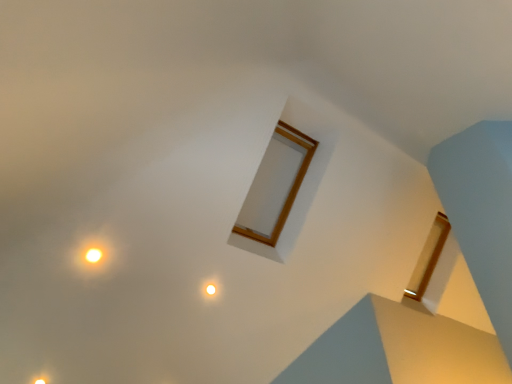
Question: Does yellow matte light at upper left, positioned as the 3th light in bottom-to-top order, appear on the left side of matte white light at center, acting as the third light starting from the front?

Choices:
 (A) no
 (B) yes

Answer: (B)

Question: Is yellow matte light at upper left, the second light positioned from the left, facing away from matte white light at center, the 2th light from the bottom?

Choices:
 (A) yes
 (B) no

Answer: (B)

Question: From a real-world perspective, is yellow matte light at upper left, acting as the 3th light starting from the back, beneath matte white light at center, the 2th light from the bottom?

Choices:
 (A) no
 (B) yes

Answer: (A)

Question: Is yellow matte light at upper left, acting as the 3th light starting from the back, touching matte white light at center, which is counted as the first light, starting from the right?

Choices:
 (A) yes
 (B) no

Answer: (B)

Question: From the image's perspective, is yellow matte light at upper left, which is the 1th light from front to back, located beneath matte white light at center, which is counted as the first light, starting from the right?

Choices:
 (A) yes
 (B) no

Answer: (B)

Question: From a real-world perspective, is matte yellow light at lower left, which is the 3th light from top to bottom, above or below yellow matte light at upper left, the second light positioned from the left?

Choices:
 (A) below
 (B) above

Answer: (A)

Question: Considering the relative positions of matte yellow light at lower left, which appears as the second light when viewed from the front, and yellow matte light at upper left, the second light viewed from the right, in the image provided, is matte yellow light at lower left, which appears as the second light when viewed from the front, to the left or to the right of yellow matte light at upper left, the second light viewed from the right,?

Choices:
 (A) right
 (B) left

Answer: (B)

Question: Considering the positions of point (38, 379) and point (83, 256), is point (38, 379) closer or farther from the camera than point (83, 256)?

Choices:
 (A) closer
 (B) farther

Answer: (B)

Question: Considering the positions of matte yellow light at lower left, which is the 3th light from right to left, and yellow matte light at upper left, positioned as the 3th light in bottom-to-top order, in the image, is matte yellow light at lower left, which is the 3th light from right to left, bigger or smaller than yellow matte light at upper left, positioned as the 3th light in bottom-to-top order,?

Choices:
 (A) small
 (B) big

Answer: (A)

Question: Based on their positions, is matte white light at center, the third light positioned from the left, located to the left or right of matte yellow light at lower left, which is the 3th light from top to bottom?

Choices:
 (A) left
 (B) right

Answer: (B)

Question: From a real-world perspective, is matte white light at center, which is counted as the first light, starting from the right, physically located above or below matte yellow light at lower left, marked as the 1th light in a left-to-right arrangement?

Choices:
 (A) above
 (B) below

Answer: (A)

Question: Is matte white light at center, which is counted as the first light, starting from the right, in front of or behind matte yellow light at lower left, which is the 3th light from right to left, in the image?

Choices:
 (A) behind
 (B) front

Answer: (A)

Question: In terms of size, does matte white light at center, acting as the third light starting from the front, appear bigger or smaller than matte yellow light at lower left, which is the 3th light from top to bottom?

Choices:
 (A) big
 (B) small

Answer: (B)

Question: Considering the relative positions of matte white light at center, the third light positioned from the left, and yellow matte light at upper left, the second light positioned from the left, in the image provided, is matte white light at center, the third light positioned from the left, to the left or to the right of yellow matte light at upper left, the second light positioned from the left,?

Choices:
 (A) right
 (B) left

Answer: (A)

Question: In terms of height, does matte white light at center, acting as the third light starting from the front, look taller or shorter compared to yellow matte light at upper left, the second light positioned from the left?

Choices:
 (A) tall
 (B) short

Answer: (B)